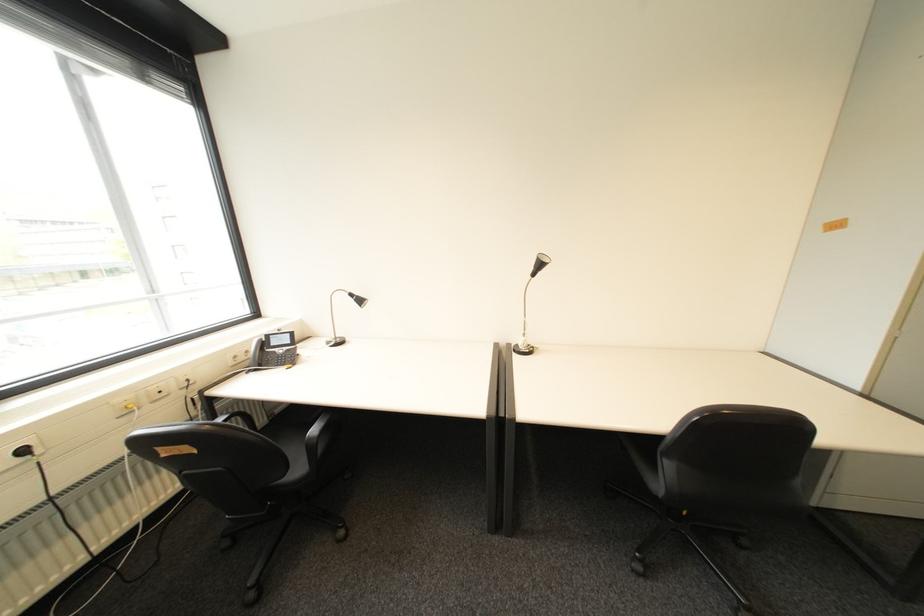
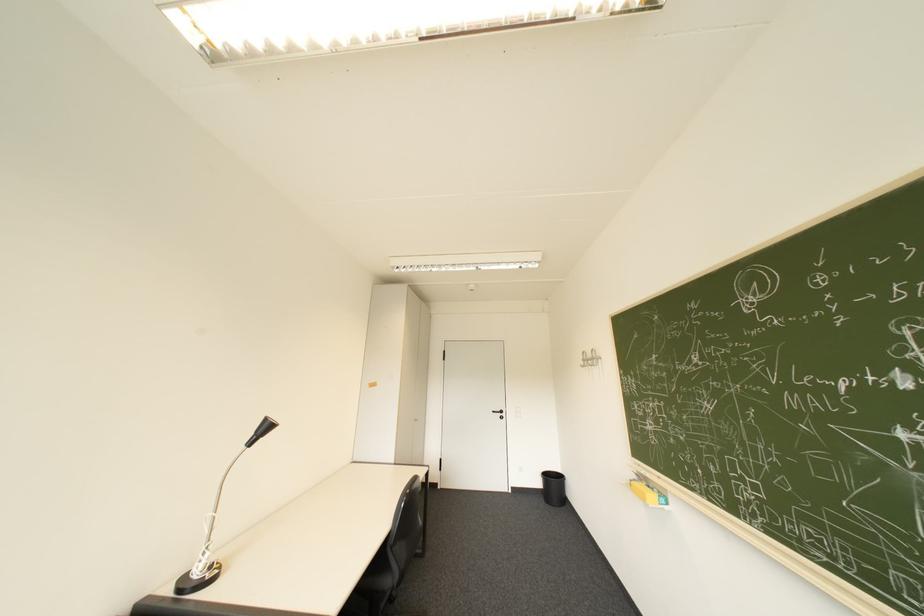
The point at (544, 267) is marked in the first image. Where is the corresponding point in the second image?

(266, 434)